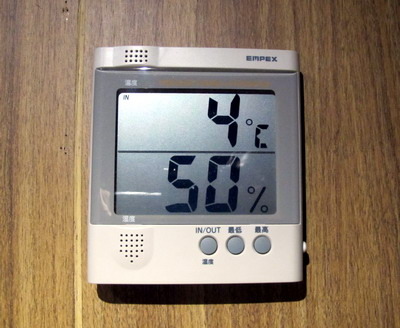
Where is `wooden surface`? wooden surface is located at coordinates point(40,80).